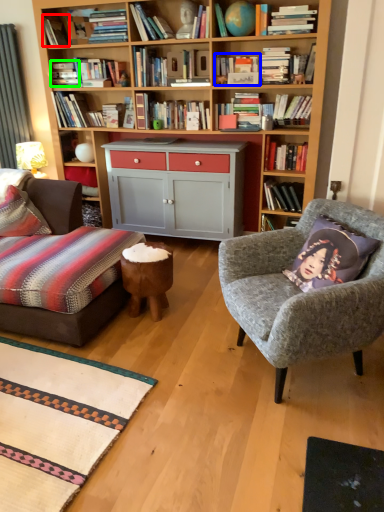
Question: Which is farther away from book (highlighted by a red box)? book (highlighted by a blue box) or book (highlighted by a green box)?

Choices:
 (A) book
 (B) book

Answer: (A)